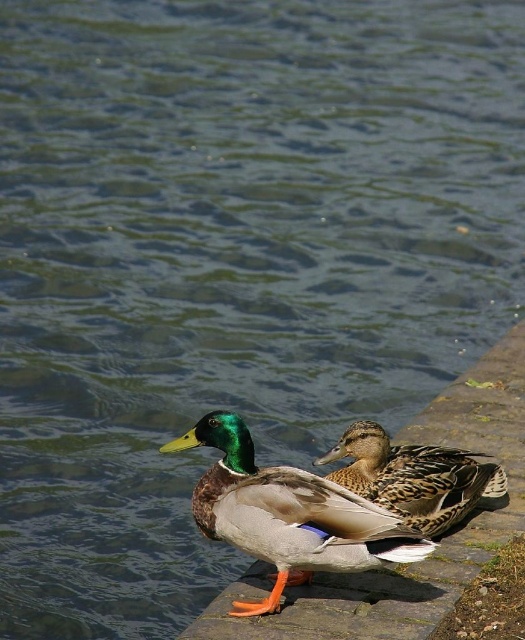
Question: Can you confirm if shiny green head at center is wider than brown speckled feathers at center?

Choices:
 (A) yes
 (B) no

Answer: (A)

Question: In this image, where is shiny green head at center located relative to brown speckled feathers at center?

Choices:
 (A) below
 (B) above

Answer: (A)

Question: Does shiny green head at center appear under brown speckled feathers at center?

Choices:
 (A) no
 (B) yes

Answer: (B)

Question: Which of the following is the closest to the observer?

Choices:
 (A) brown speckled feathers at center
 (B) shiny green head at center

Answer: (B)

Question: Which of the following is the farthest from the observer?

Choices:
 (A) brown speckled feathers at center
 (B) shiny green head at center

Answer: (A)

Question: Which object appears closest to the camera in this image?

Choices:
 (A) shiny green head at center
 (B) brown speckled feathers at center

Answer: (A)